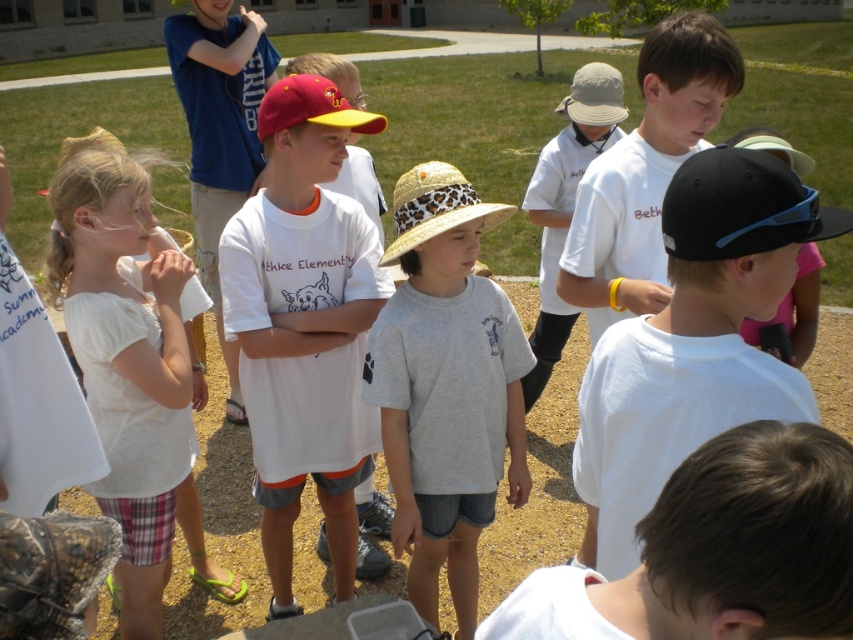
Can you confirm if gray cotton shirt at center is positioned to the right of white cotton shirt at left?

Indeed, gray cotton shirt at center is positioned on the right side of white cotton shirt at left.

Based on the photo, can you confirm if gray cotton shirt at center is positioned below white cotton shirt at left?

Yes, gray cotton shirt at center is below white cotton shirt at left.

Where is `gray cotton shirt at center`? The width and height of the screenshot is (853, 640). gray cotton shirt at center is located at coordinates (445, 387).

Is brown hair at lower right above black matte cap at center?

No.

Is brown hair at lower right bigger than black matte cap at center?

Incorrect, brown hair at lower right is not larger than black matte cap at center.

What do you see at coordinates (717, 550) in the screenshot? This screenshot has width=853, height=640. I see `brown hair at lower right` at bounding box center [717, 550].

Identify the location of brown hair at lower right. Image resolution: width=853 pixels, height=640 pixels. (717, 550).

Does point (531, 612) come behind point (90, 352)?

No, it is not.

Can you confirm if brown hair at lower right is thinner than white cotton shirt at left?

Correct, brown hair at lower right's width is less than white cotton shirt at left's.

The image size is (853, 640). In order to click on brown hair at lower right in this screenshot , I will do `click(717, 550)`.